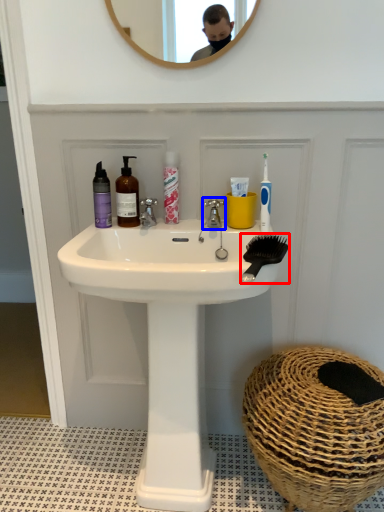
Question: Which of the following is the closest to the observer, comb (highlighted by a red box) or tap (highlighted by a blue box)?

Choices:
 (A) comb
 (B) tap

Answer: (A)